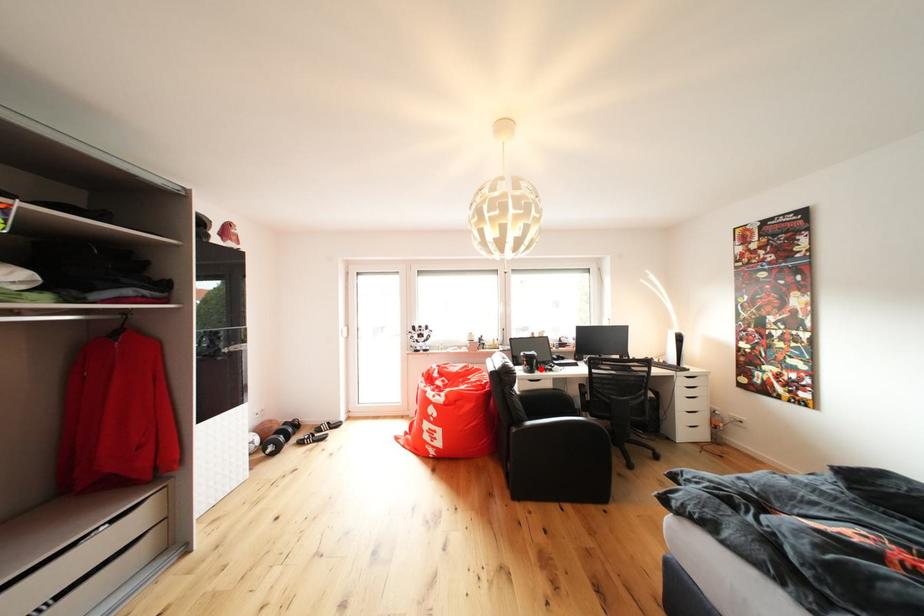
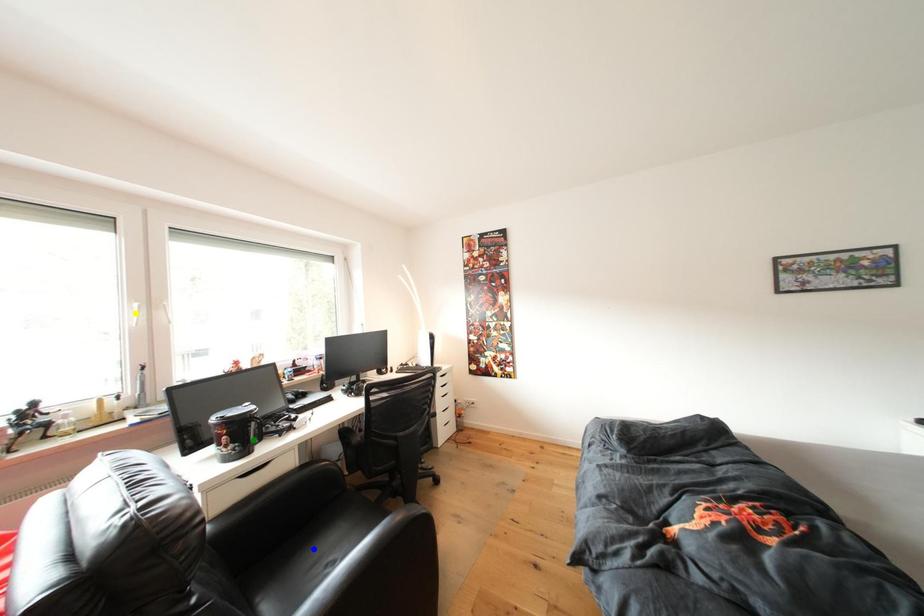
Question: I am providing you with two images of the same scene from different viewpoints. A red point is marked on the first image. You are given multiple points on the second image. Can you choose the point in image 2 that corresponds to the point in image 1?

Choices:
 (A) blue point
 (B) yellow point
 (C) green point

Answer: (C)